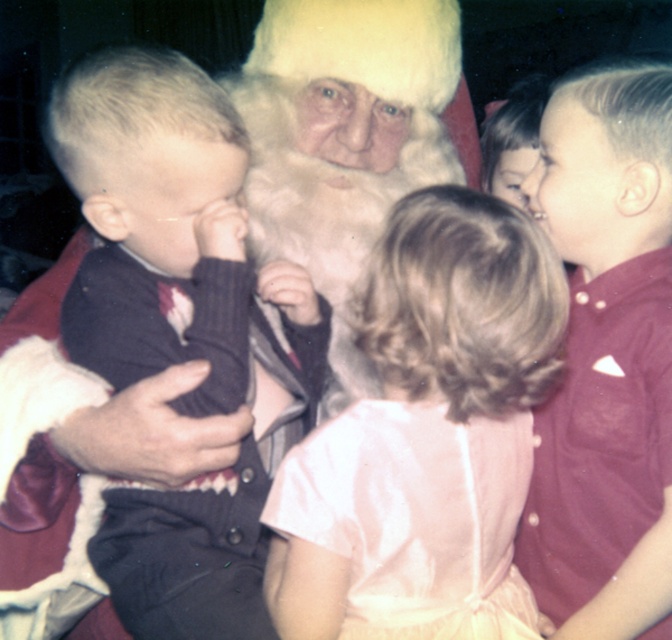
Question: Is dark blue sweater at left to the right of pink satin dress at center from the viewer's perspective?

Choices:
 (A) no
 (B) yes

Answer: (A)

Question: Does dark blue sweater at left appear on the left side of maroon button-up shirt at right?

Choices:
 (A) no
 (B) yes

Answer: (B)

Question: Which object is farther from the camera taking this photo?

Choices:
 (A) pink satin dress at center
 (B) maroon button-up shirt at right

Answer: (B)

Question: Which point appears closest to the camera in this image?

Choices:
 (A) (632, 243)
 (B) (224, 618)

Answer: (B)

Question: Which object is positioned closest to the maroon button-up shirt at right?

Choices:
 (A) dark blue sweater at left
 (B) pink satin dress at center

Answer: (B)

Question: Does pink satin dress at center have a larger size compared to maroon button-up shirt at right?

Choices:
 (A) yes
 (B) no

Answer: (A)